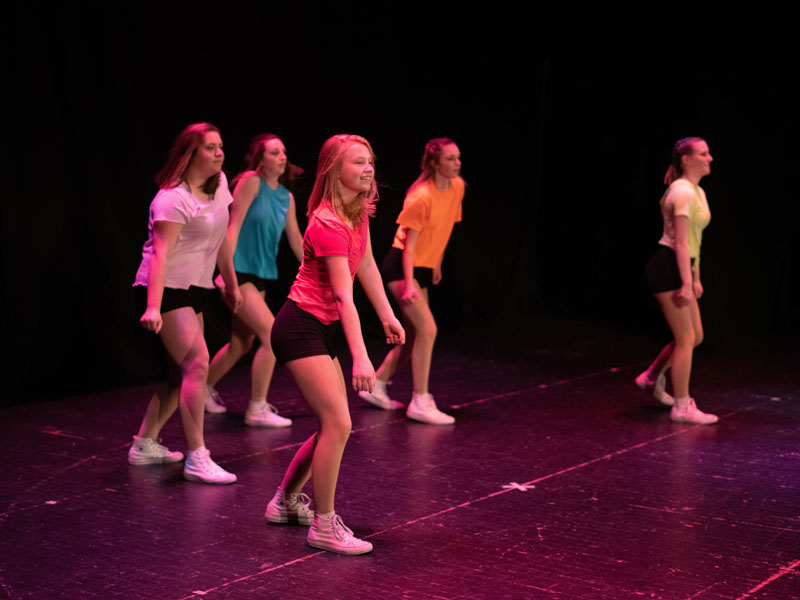
The width and height of the screenshot is (800, 600). I want to click on stage, so click(x=641, y=518), click(x=533, y=446), click(x=85, y=533).